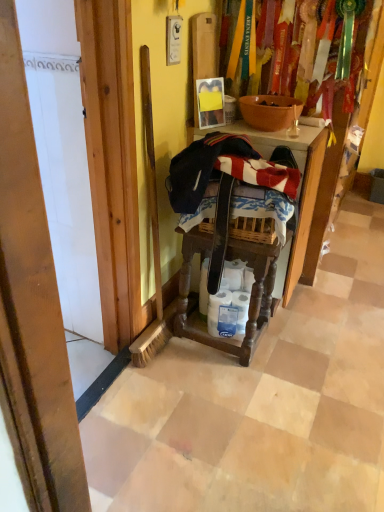
Question: In the image, is white matte toilet paper at center on the left side or the right side of wooden step stool at center?

Choices:
 (A) left
 (B) right

Answer: (B)

Question: Considering the positions of white matte toilet paper at center and wooden step stool at center in the image, is white matte toilet paper at center bigger or smaller than wooden step stool at center?

Choices:
 (A) big
 (B) small

Answer: (B)

Question: Estimate the real-world distances between objects in this image. Which object is farther from the wooden step stool at center?

Choices:
 (A) matte orange bowl at center
 (B) white matte toilet paper at center

Answer: (A)

Question: Which of these objects is positioned closest to the matte orange bowl at center?

Choices:
 (A) white matte toilet paper at center
 (B) wooden step stool at center

Answer: (B)